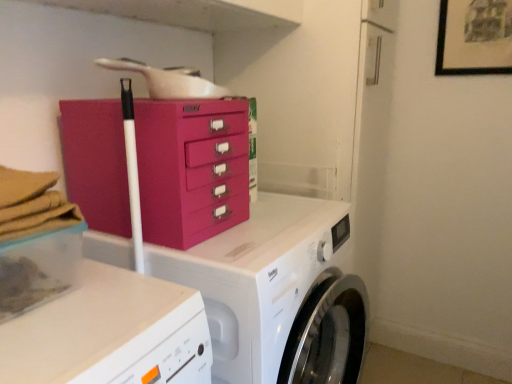
Question: Is black matte picture frame at upper right with fuchsia plastic chest of drawers at center?

Choices:
 (A) no
 (B) yes

Answer: (A)

Question: From a real-world perspective, does black matte picture frame at upper right stand above fuchsia plastic chest of drawers at center?

Choices:
 (A) yes
 (B) no

Answer: (A)

Question: Is black matte picture frame at upper right far from fuchsia plastic chest of drawers at center?

Choices:
 (A) yes
 (B) no

Answer: (A)

Question: Can you confirm if black matte picture frame at upper right is bigger than fuchsia plastic chest of drawers at center?

Choices:
 (A) yes
 (B) no

Answer: (B)

Question: Does black matte picture frame at upper right have a lesser width compared to fuchsia plastic chest of drawers at center?

Choices:
 (A) yes
 (B) no

Answer: (A)

Question: From the image's perspective, is black matte picture frame at upper right below fuchsia plastic chest of drawers at center?

Choices:
 (A) no
 (B) yes

Answer: (A)

Question: Can you confirm if black matte picture frame at upper right is smaller than white glossy washing machine at center?

Choices:
 (A) no
 (B) yes

Answer: (B)

Question: Can you confirm if black matte picture frame at upper right is wider than white glossy washing machine at center?

Choices:
 (A) no
 (B) yes

Answer: (A)

Question: Does black matte picture frame at upper right lie behind white glossy washing machine at center?

Choices:
 (A) yes
 (B) no

Answer: (A)

Question: Is black matte picture frame at upper right not close to white glossy washing machine at center?

Choices:
 (A) yes
 (B) no

Answer: (A)

Question: Is black matte picture frame at upper right taller than white glossy washing machine at center?

Choices:
 (A) yes
 (B) no

Answer: (B)

Question: Is black matte picture frame at upper right positioned in front of white glossy washing machine at center?

Choices:
 (A) no
 (B) yes

Answer: (A)

Question: From the image's perspective, is fuchsia plastic chest of drawers at center beneath clear plastic container at lower left?

Choices:
 (A) no
 (B) yes

Answer: (A)